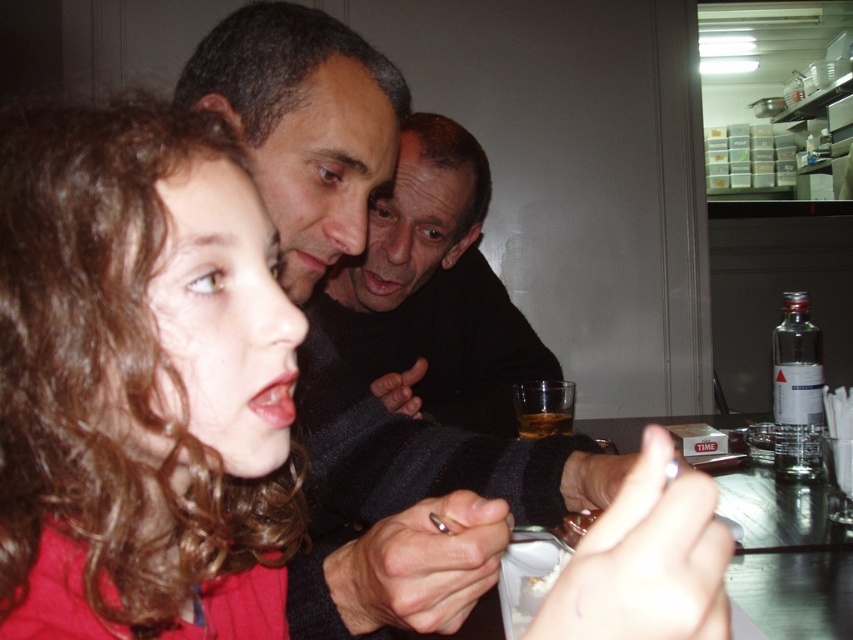
Question: Which is nearer to the translucent glass bottle at center?

Choices:
 (A) dark matte face at center
 (B) curly hair at center

Answer: (A)

Question: Which of the following is the closest to the observer?

Choices:
 (A) dark matte face at center
 (B) translucent glass bottle at center
 (C) curly hair at center

Answer: (C)

Question: Does curly hair at center come behind translucent glass bottle at center?

Choices:
 (A) no
 (B) yes

Answer: (A)

Question: Is curly hair at center thinner than dark matte face at center?

Choices:
 (A) yes
 (B) no

Answer: (A)

Question: Considering the real-world distances, which object is closest to the dark matte face at center?

Choices:
 (A) curly hair at center
 (B) translucent glass bottle at center

Answer: (B)

Question: Does curly hair at center have a smaller size compared to dark matte face at center?

Choices:
 (A) no
 (B) yes

Answer: (B)